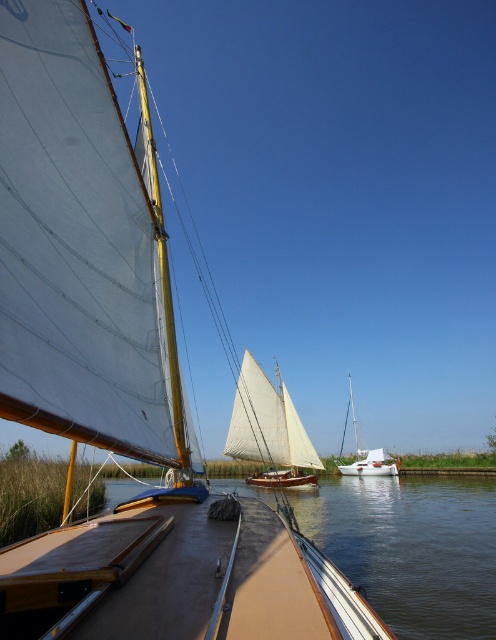
Question: Which point is farther to the camera?

Choices:
 (A) white canvas sailboat at center
 (B) white matte sailboat at center

Answer: (B)

Question: Is white canvas sailboat at center behind white matte sailboat at center?

Choices:
 (A) yes
 (B) no

Answer: (B)

Question: Does white canvas sailboat at center have a lesser width compared to white matte sailboat at center?

Choices:
 (A) no
 (B) yes

Answer: (B)

Question: Where is white canvas sailboat at center located in relation to white matte sailboat at center in the image?

Choices:
 (A) below
 (B) above

Answer: (B)

Question: Among these points, which one is farthest from the camera?

Choices:
 (A) (246, 458)
 (B) (368, 467)

Answer: (B)